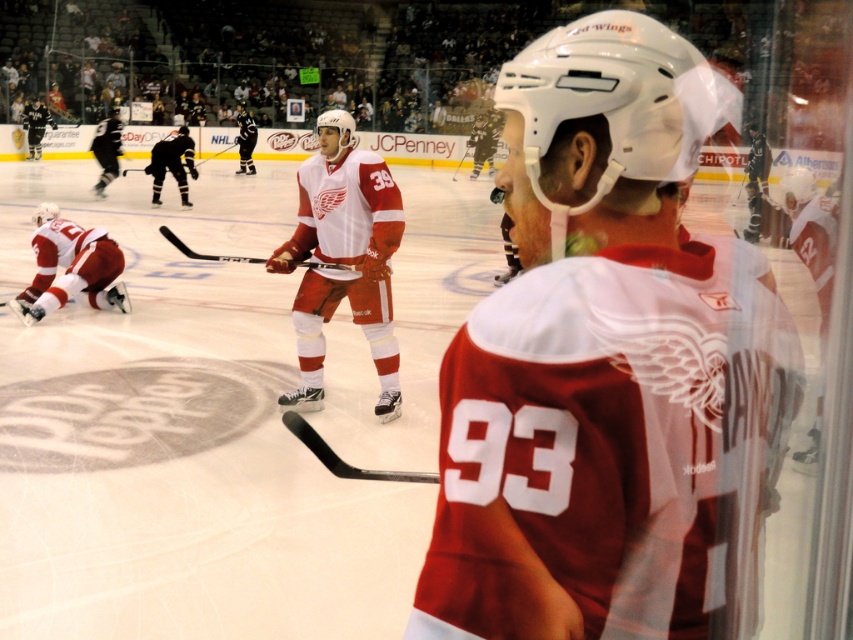
You are a photographer at the hockey game and want to capture both the matte red jersey at center and the matte red jersey at lower left in a single shot. Based on their positions, which jersey should you focus on first to ensure both are in frame?

The matte red jersey at center is positioned on the right side of matte red jersey at lower left, so focusing on the matte red jersey at lower left first will allow the photographer to frame both by adjusting the camera to include the right side as well.

You are a spectator at the hockey game and want to take a photo of the point at coordinates (335, 268). The arena has a rule that spectators must be at least 5 meters away from any point on the ice to avoid obstructing the game. Is your current position compliant with this rule?

The point at coordinates (335, 268) is 6.28 meters away from the camera, which means it is more than 5 meters away. Therefore, your current position is compliant with the arena rules.